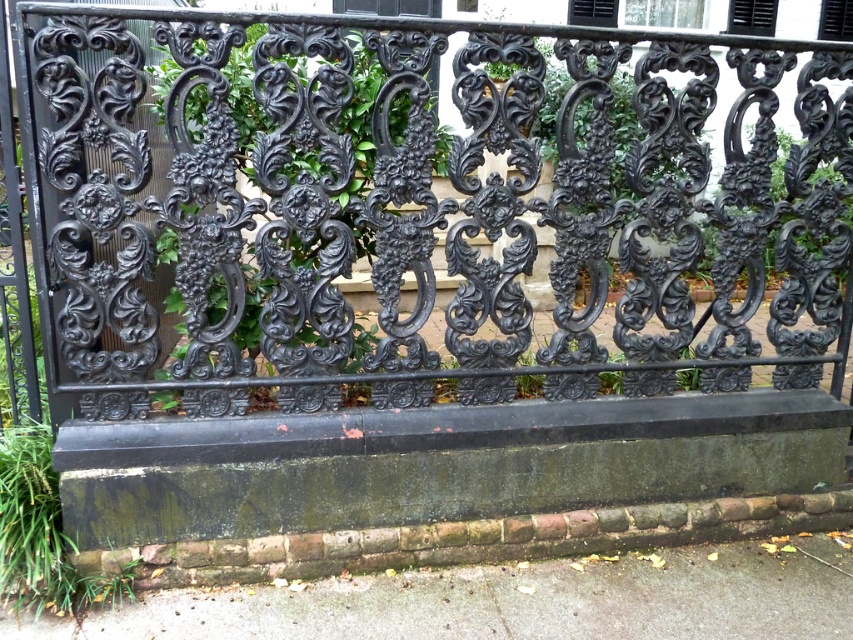
Who is shorter, black wrought iron fence at center or gray concrete pavement at lower center?

With less height is gray concrete pavement at lower center.

Based on the photo, who is more distant from viewer, (315, 192) or (281, 636)?

The point (315, 192) is more distant.

Where is `black wrought iron fence at center`? The image size is (853, 640). black wrought iron fence at center is located at coordinates (425, 209).